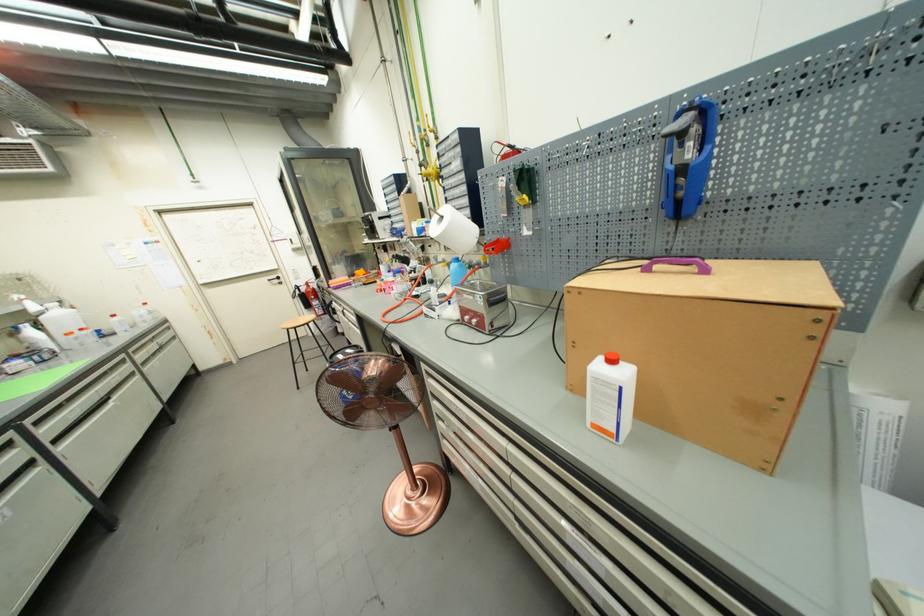
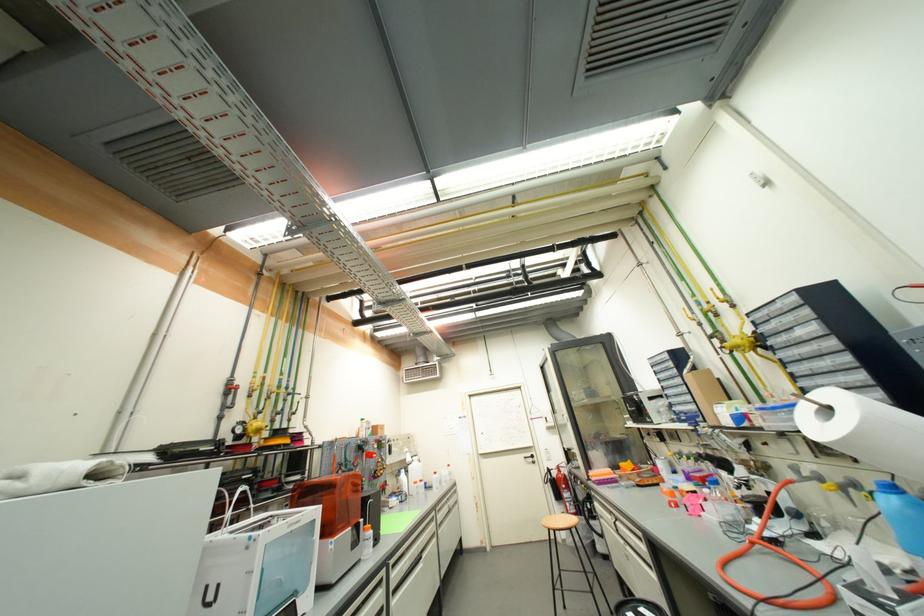
Find the pixel in the second image that matches point 52,440 in the first image.

(396, 590)